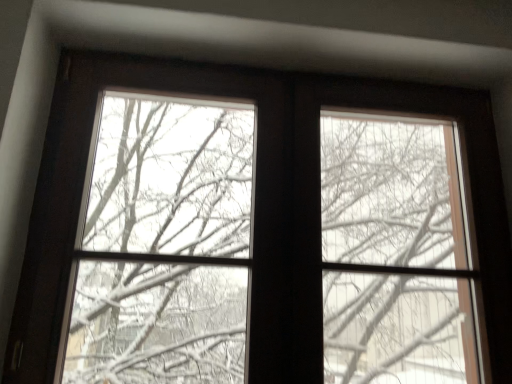
Image resolution: width=512 pixels, height=384 pixels. What are the coordinates of `brown wooden window at center` in the screenshot? It's located at (174, 242).

What do you see at coordinates (174, 242) in the screenshot? I see `brown wooden window at center` at bounding box center [174, 242].

Locate an element on the screen. The width and height of the screenshot is (512, 384). brown wooden window at center is located at coordinates (174, 242).